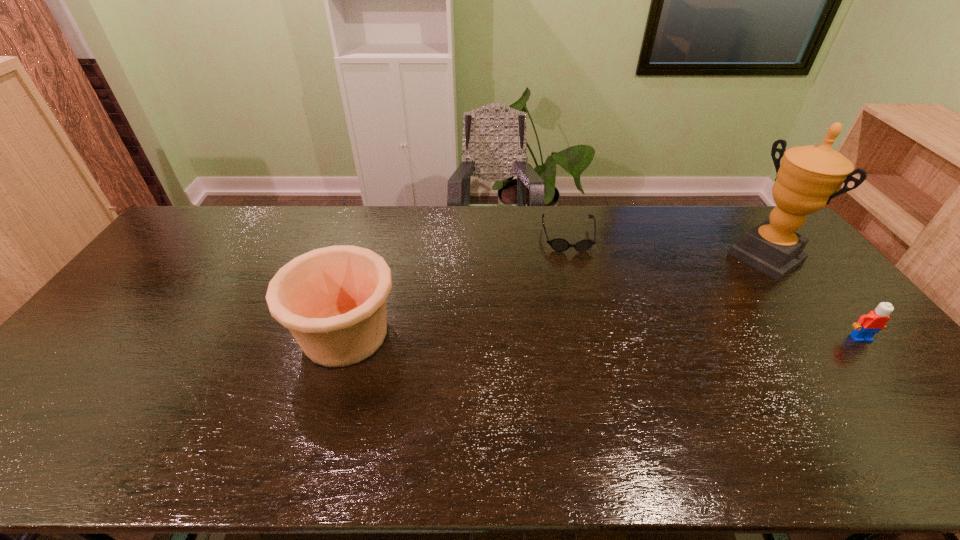
At what (x,y) coordinates should I click in order to perform the action: click on empty location between the sunglasses and the second tallest object. Please return your answer as a coordinate pair (x, y). Looking at the image, I should click on (457, 286).

Locate an element on the screen. This screenshot has width=960, height=540. free spot between the second shortest object and the third shortest object is located at coordinates click(603, 336).

Where is `object identified as the closest to the second object from left to right`? The height and width of the screenshot is (540, 960). object identified as the closest to the second object from left to right is located at coordinates (809, 177).

Image resolution: width=960 pixels, height=540 pixels. What are the coordinates of `object that is the closest to the third object from right to left` in the screenshot? It's located at (809, 177).

Find the location of a particular element. This screenshot has height=540, width=960. vacant region that satisfies the following two spatial constraints: 1. on the back side of the tallest object; 2. on the left side of the leftmost object is located at coordinates (369, 258).